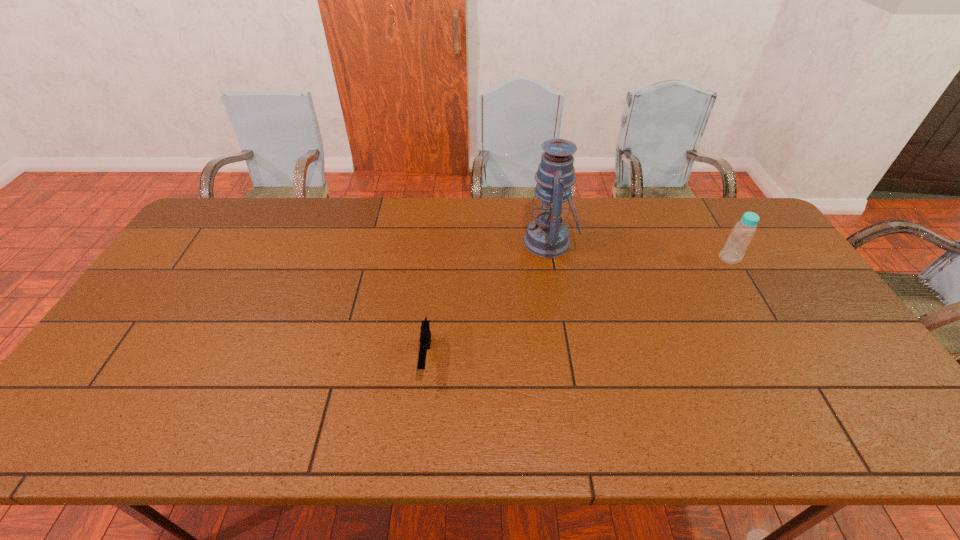
Locate an element on the screen. Image resolution: width=960 pixels, height=540 pixels. the second object from left to right is located at coordinates (547, 236).

This screenshot has height=540, width=960. Find the location of `lantern`. lantern is located at coordinates (547, 236).

At what (x,y) coordinates should I click in order to perform the action: click on the rightmost object. Please return your answer as a coordinate pair (x, y). This screenshot has width=960, height=540. Looking at the image, I should click on (744, 230).

Identify the location of bottle. (744, 230).

Where is `the nearest object`? the nearest object is located at coordinates (425, 336).

The image size is (960, 540). Find the location of `the leftmost object`. the leftmost object is located at coordinates (425, 336).

What are the coordinates of `vacant space located 0.300m on the front-facing side of the second object from right to left` in the screenshot? It's located at (431, 242).

Locate an element on the screen. Image resolution: width=960 pixels, height=540 pixels. free spot located on the front-facing side of the second object from right to left is located at coordinates (477, 242).

Identify the location of vacant space located on the front-facing side of the second object from right to left. Image resolution: width=960 pixels, height=540 pixels. (440, 242).

At what (x,y) coordinates should I click in order to perform the action: click on vacant space located 0.060m on the right of the rightmost object. Please return your answer as a coordinate pair (x, y). The width and height of the screenshot is (960, 540). Looking at the image, I should click on (x=761, y=258).